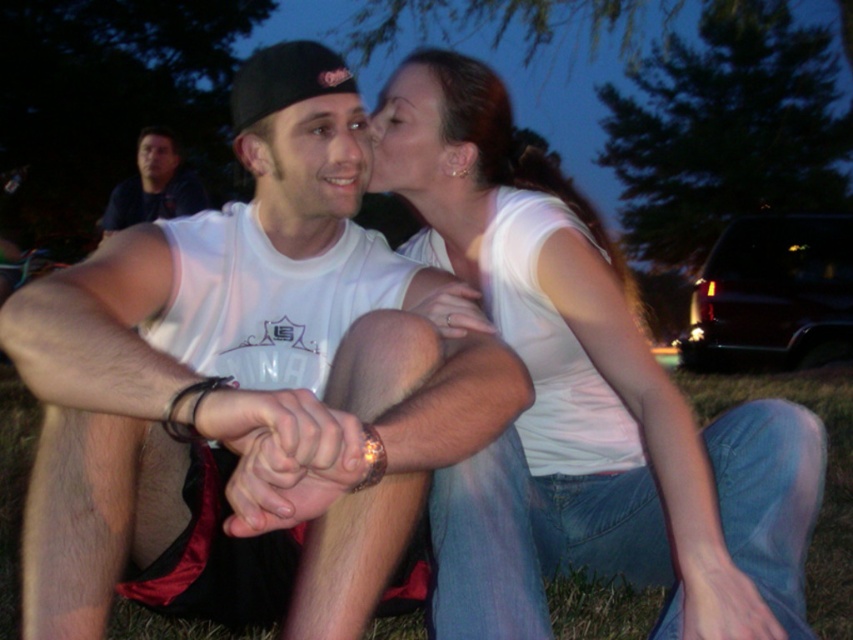
Question: Is white matte t-shirt at center smaller than green grass at lower center?

Choices:
 (A) no
 (B) yes

Answer: (A)

Question: Which point appears closest to the camera in this image?

Choices:
 (A) 685,371
 (B) 184,186
 (C) 819,442

Answer: (C)

Question: Does white matte t-shirt at center appear on the left side of matte black face at upper left?

Choices:
 (A) no
 (B) yes

Answer: (A)

Question: Which of the following is the closest to the observer?

Choices:
 (A) (360, 154)
 (B) (155, 240)

Answer: (B)

Question: Based on their relative distances, which object is farther from the dark blue shirt at upper left?

Choices:
 (A) matte black face at upper left
 (B) white matte shirt at upper center
 (C) white matte t-shirt at center

Answer: (C)

Question: Is green grass at lower center above matte white face at upper center?

Choices:
 (A) yes
 (B) no

Answer: (B)